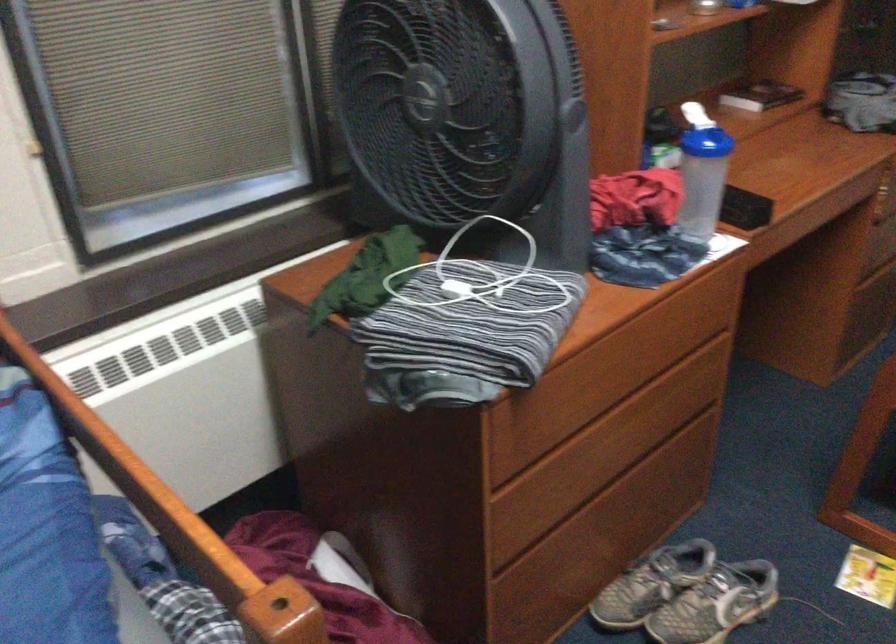
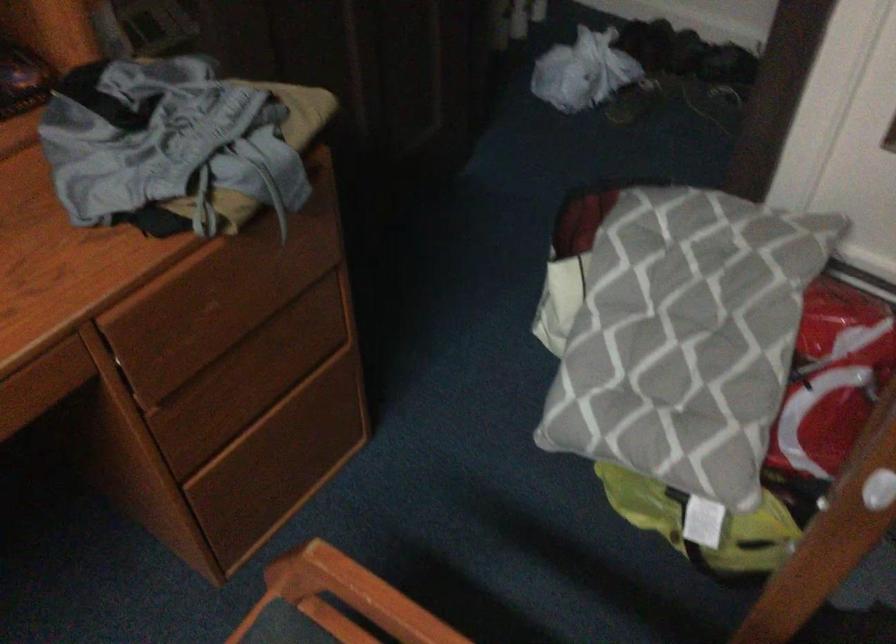
The images are taken continuously from a first-person perspective. In which direction are you moving?

The movement direction of the cameraman is right, forward.